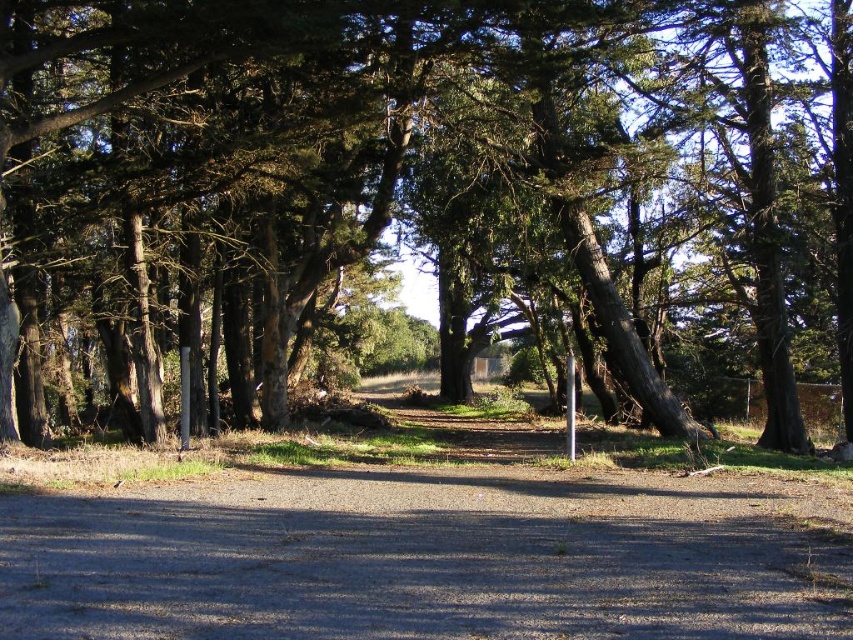
Can you confirm if green textured tree at center is positioned below gray gravel dirt track at center?

Incorrect, green textured tree at center is not positioned below gray gravel dirt track at center.

Locate an element on the screen. This screenshot has width=853, height=640. green textured tree at center is located at coordinates (431, 161).

This screenshot has height=640, width=853. Identify the location of green textured tree at center. (431, 161).